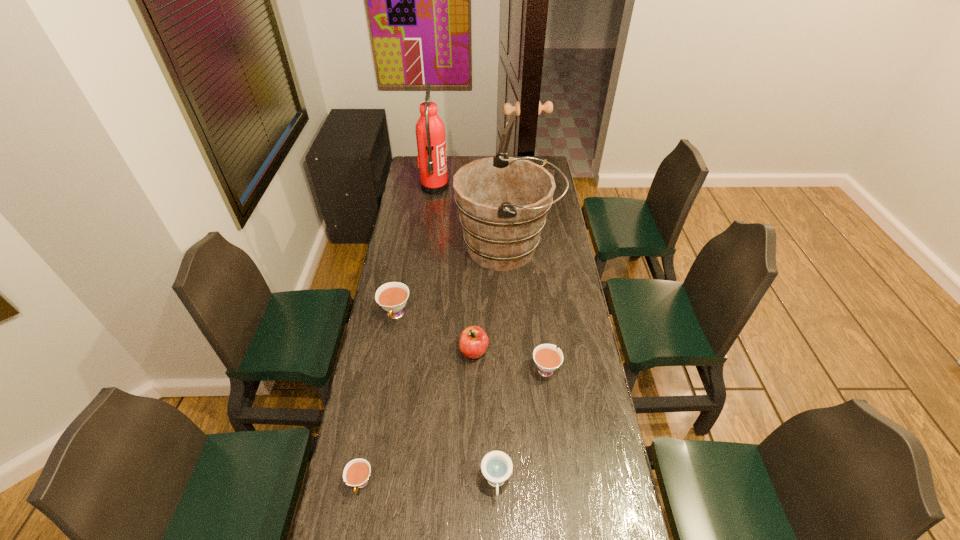
Identify the location of the shortest teacup. This screenshot has height=540, width=960. (356, 473).

Locate an element on the screen. the smallest white teacup is located at coordinates (356, 473).

Locate an element on the screen. The width and height of the screenshot is (960, 540). free space located on the label side of the fire extinguisher is located at coordinates (518, 187).

What are the coordinates of `free space located 0.050m on the handle side of the brown bucket` in the screenshot? It's located at (568, 248).

Where is `free space located on the left of the phonograph record`? The image size is (960, 540). free space located on the left of the phonograph record is located at coordinates (478, 185).

This screenshot has height=540, width=960. Find the location of `vacant position located 0.160m on the right of the red apple`. vacant position located 0.160m on the right of the red apple is located at coordinates (531, 350).

The width and height of the screenshot is (960, 540). Identify the location of vacant space situated on the side of the biggest white teacup with the handle. (390, 346).

Image resolution: width=960 pixels, height=540 pixels. In order to click on free space located on the side of the rightmost white teacup with the handle in this screenshot , I will do `click(536, 292)`.

Locate an element on the screen. The image size is (960, 540). free space located 0.300m on the side of the rightmost white teacup with the handle is located at coordinates (537, 295).

Identify the location of vacant space located 0.350m on the side of the rightmost white teacup with the handle. The width and height of the screenshot is (960, 540). click(x=536, y=287).